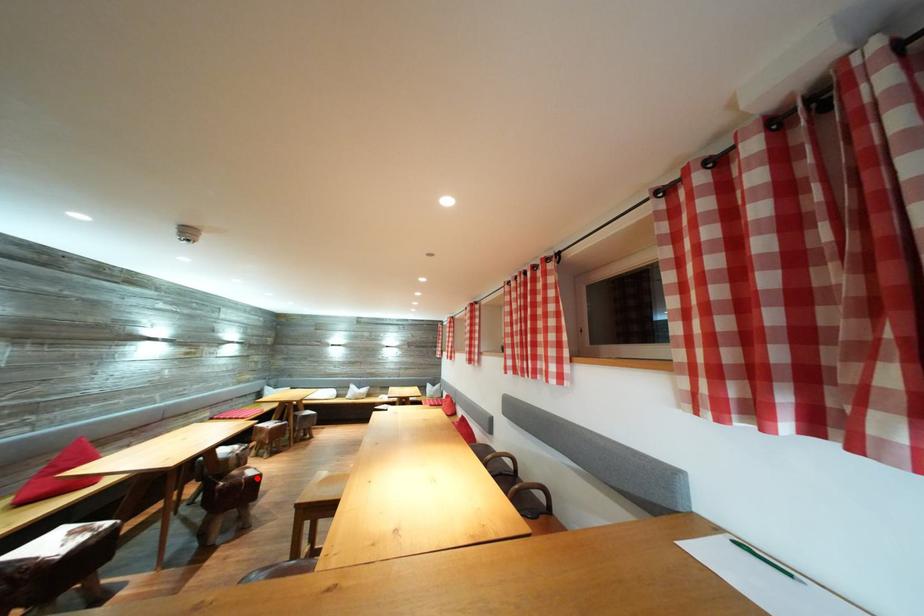
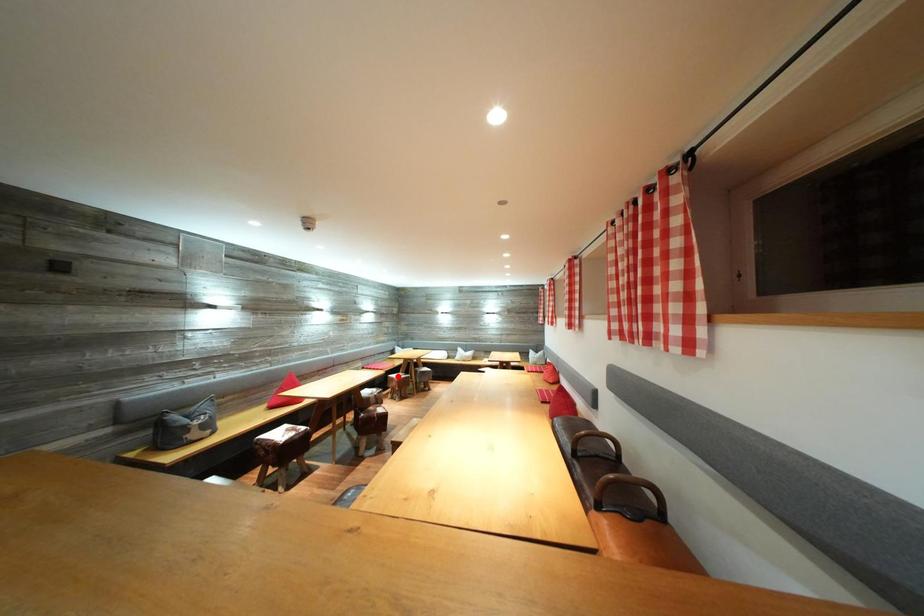
I am providing you with two images of the same scene from different viewpoints. A red point is marked on the first image and another point is marked on the second image. Is the red point in image1 aligned with the point shown in image2?

No